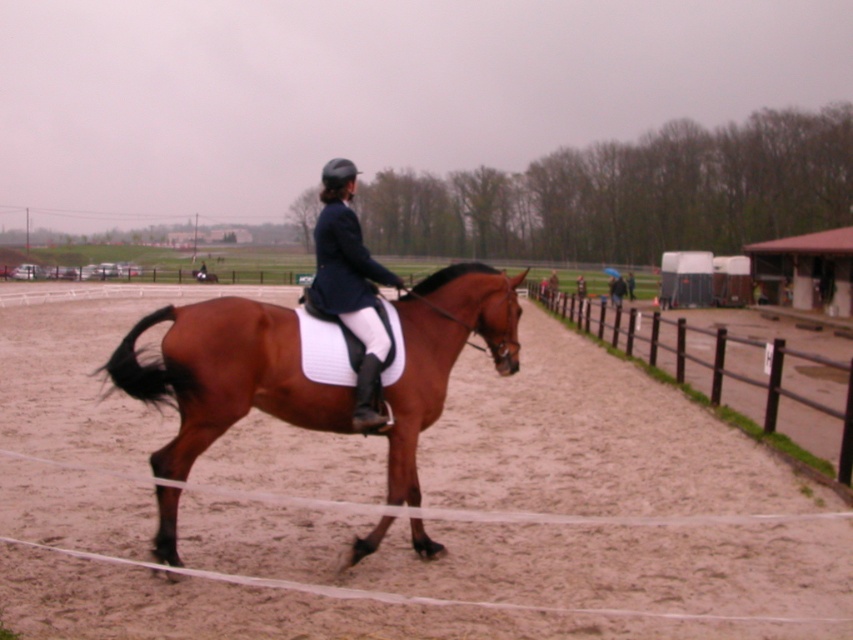
Who is shorter, brown wooden fence at right or matte black riding jacket at center?

Standing shorter between the two is matte black riding jacket at center.

Identify the location of brown wooden fence at right. (711, 364).

Can you confirm if brown sand at center is positioned to the left of matte black riding jacket at center?

Indeed, brown sand at center is positioned on the left side of matte black riding jacket at center.

How far apart are brown sand at center and matte black riding jacket at center?

brown sand at center is 7.94 meters away from matte black riding jacket at center.

Image resolution: width=853 pixels, height=640 pixels. Identify the location of brown sand at center. (485, 524).

Can you confirm if brown glossy horse at center is smaller than matte black riding jacket at center?

Incorrect, brown glossy horse at center is not smaller in size than matte black riding jacket at center.

Is brown glossy horse at center in front of matte black riding jacket at center?

Yes, brown glossy horse at center is closer to the viewer.

Does point (250, 310) come farther from viewer compared to point (367, 292)?

No.

Locate an element on the screen. Image resolution: width=853 pixels, height=640 pixels. brown glossy horse at center is located at coordinates (225, 376).